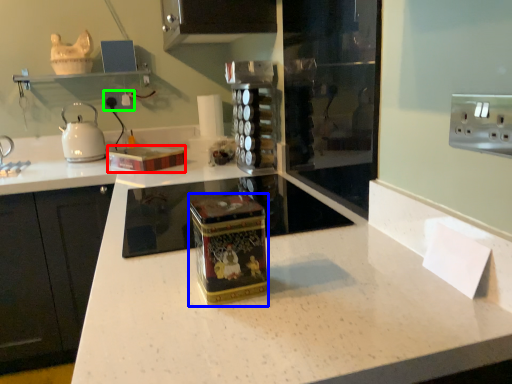
Question: Based on their relative distances, which object is nearer to box (highlighted by a red box)? Choose from appliance (highlighted by a blue box) and electric outlet (highlighted by a green box).

Choices:
 (A) appliance
 (B) electric outlet

Answer: (B)